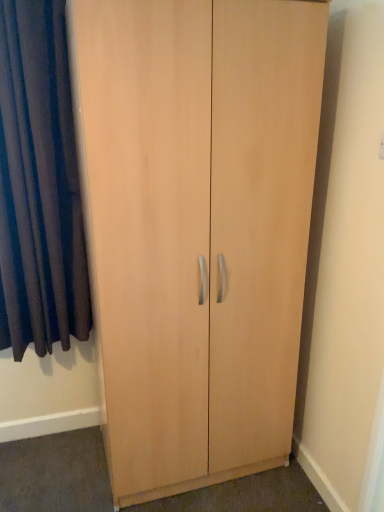
The height and width of the screenshot is (512, 384). What do you see at coordinates (39, 185) in the screenshot?
I see `dark blue velvet curtain at left` at bounding box center [39, 185].

Identify the location of dark blue velvet curtain at left. (39, 185).

What do you see at coordinates (197, 227) in the screenshot? I see `light wood cupboard at center` at bounding box center [197, 227].

Find the location of a particular element. The width and height of the screenshot is (384, 512). light wood cupboard at center is located at coordinates pyautogui.click(x=197, y=227).

The width and height of the screenshot is (384, 512). Identify the location of dark blue velvet curtain at left. (39, 185).

Considering the positions of objects light wood cupboard at center and dark blue velvet curtain at left in the image provided, who is more to the left, light wood cupboard at center or dark blue velvet curtain at left?

From the viewer's perspective, dark blue velvet curtain at left appears more on the left side.

Is light wood cupboard at center in front of or behind dark blue velvet curtain at left in the image?

In the image, light wood cupboard at center appears in front of dark blue velvet curtain at left.

Between point (213, 251) and point (73, 144), which one is positioned in front?

The point (213, 251) is in front.

From the picture: From the image's perspective, which is below, light wood cupboard at center or dark blue velvet curtain at left?

light wood cupboard at center is shown below in the image.

From a real-world perspective, is light wood cupboard at center physically below dark blue velvet curtain at left?

Correct, in the physical world, light wood cupboard at center is lower than dark blue velvet curtain at left.

Which object is thinner, light wood cupboard at center or dark blue velvet curtain at left?

Thinner between the two is dark blue velvet curtain at left.

Considering the relative sizes of light wood cupboard at center and dark blue velvet curtain at left in the image provided, is light wood cupboard at center shorter than dark blue velvet curtain at left?

In fact, light wood cupboard at center may be taller than dark blue velvet curtain at left.

Does light wood cupboard at center have a larger size compared to dark blue velvet curtain at left?

Correct, light wood cupboard at center is larger in size than dark blue velvet curtain at left.

Is dark blue velvet curtain at left inside light wood cupboard at center?

No, dark blue velvet curtain at left is not a part of light wood cupboard at center.

Is light wood cupboard at center directly adjacent to dark blue velvet curtain at left?

No, light wood cupboard at center is not beside dark blue velvet curtain at left.

Is dark blue velvet curtain at left at the back of light wood cupboard at center?

No, light wood cupboard at center is not facing the opposite direction of dark blue velvet curtain at left.

What's the angular difference between light wood cupboard at center and dark blue velvet curtain at left's facing directions?

The angular difference between light wood cupboard at center and dark blue velvet curtain at left is 0.367 degrees.

In the scene shown: How much distance is there between light wood cupboard at center and dark blue velvet curtain at left?

22.80 inches.

Where is `cupboard that is below the dark blue velvet curtain at left (from the image's perspective)`? cupboard that is below the dark blue velvet curtain at left (from the image's perspective) is located at coordinates (197, 227).

From the picture: Which is more to the right, dark blue velvet curtain at left or light wood cupboard at center?

light wood cupboard at center is more to the right.

Which object is further away from the camera taking this photo, dark blue velvet curtain at left or light wood cupboard at center?

dark blue velvet curtain at left is more distant.

Does point (50, 310) lie in front of point (303, 244)?

No.

From the image's perspective, which object appears higher, dark blue velvet curtain at left or light wood cupboard at center?

dark blue velvet curtain at left appears higher in the image.

From a real-world perspective, is dark blue velvet curtain at left positioned above or below light wood cupboard at center?

dark blue velvet curtain at left is above light wood cupboard at center.

Is dark blue velvet curtain at left wider or thinner than light wood cupboard at center?

Clearly, dark blue velvet curtain at left has less width compared to light wood cupboard at center.

Is dark blue velvet curtain at left taller than light wood cupboard at center?

Incorrect, the height of dark blue velvet curtain at left is not larger of that of light wood cupboard at center.

Considering the relative sizes of dark blue velvet curtain at left and light wood cupboard at center in the image provided, is dark blue velvet curtain at left bigger than light wood cupboard at center?

Actually, dark blue velvet curtain at left might be smaller than light wood cupboard at center.

Could light wood cupboard at center be considered to be inside dark blue velvet curtain at left?

No, light wood cupboard at center is not a part of dark blue velvet curtain at left.

Are dark blue velvet curtain at left and light wood cupboard at center located far from each other?

dark blue velvet curtain at left is near light wood cupboard at center, not far away.

Is dark blue velvet curtain at left oriented towards light wood cupboard at center?

No, dark blue velvet curtain at left is not oriented towards light wood cupboard at center.

Can you tell me how much dark blue velvet curtain at left and light wood cupboard at center differ in facing direction?

The angle between the facing direction of dark blue velvet curtain at left and the facing direction of light wood cupboard at center is 0.367 degrees.

How much distance is there between dark blue velvet curtain at left and light wood cupboard at center?

dark blue velvet curtain at left is 57.91 centimeters from light wood cupboard at center.

Locate an element on the screen. Image resolution: width=384 pixels, height=512 pixels. curtain on the left of the light wood cupboard at center is located at coordinates (39, 185).

Where is `curtain on the left of the light wood cupboard at center`? The width and height of the screenshot is (384, 512). curtain on the left of the light wood cupboard at center is located at coordinates (39, 185).

Find the location of a particular element. The height and width of the screenshot is (512, 384). curtain above the light wood cupboard at center (from a real-world perspective) is located at coordinates (39, 185).